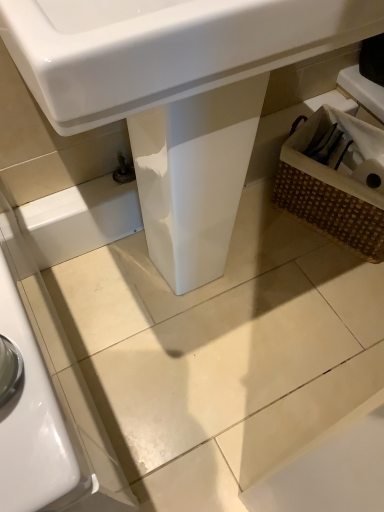
Where is `free space below white glossy sink at center (from a real-world perspective)`? The image size is (384, 512). free space below white glossy sink at center (from a real-world perspective) is located at coordinates (173, 290).